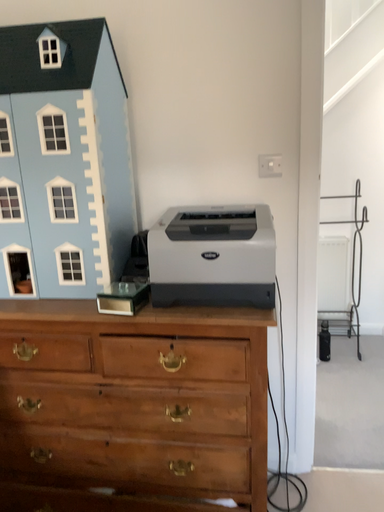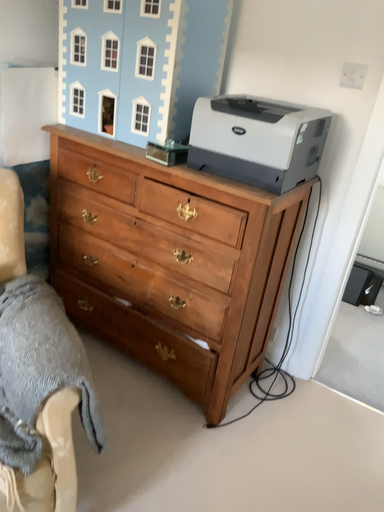
Question: How did the camera likely rotate when shooting the video?

Choices:
 (A) rotated left
 (B) rotated right

Answer: (A)